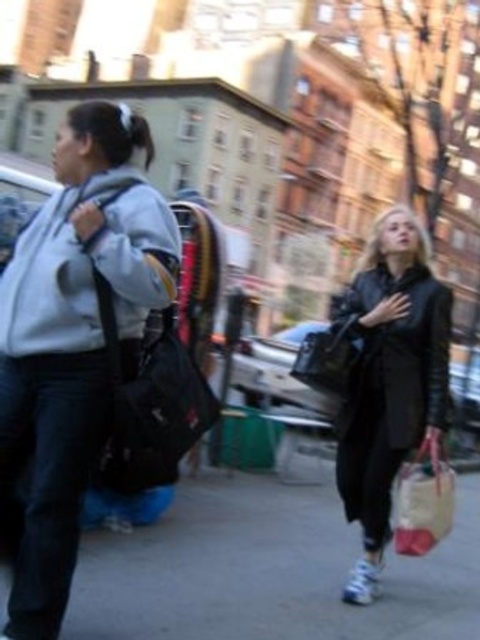
You are a delivery person trying to avoid getting wet in the rain. You see a matte gray hoodie at left and a shiny black handbag at center. Which item is closer to you and can potentially shield you from the rain?

The matte gray hoodie at left is closer to the viewer, so it can potentially shield you from the rain.

You are standing on the sidewalk in the urban street scene and want to reach a point that is closer to you. Which point should you go to, point 1 at coordinates [199,550] or point 2 at coordinates [344,433]?

Result: Point 1 at coordinates [199,550] is closer to you because it is further to the viewer than point 2 at coordinates [344,433].